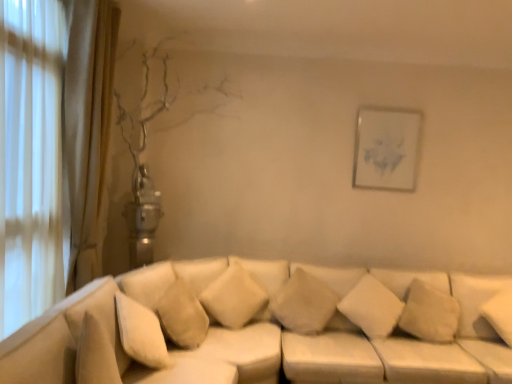
Question: Relative to white soft cushion at center, the fourth pillow positioned from the right, is white paper at upper right in front or behind?

Choices:
 (A) behind
 (B) front

Answer: (A)

Question: Is point (412, 137) positioned closer to the camera than point (229, 309)?

Choices:
 (A) farther
 (B) closer

Answer: (A)

Question: Considering the real-world distances, which object is closest to the white soft cushion at center, which ranks as the first pillow in left-to-right order?

Choices:
 (A) white soft pillow at right, which is the 1th pillow in right-to-left order
 (B) white soft pillow at center, which is counted as the 2th pillow, starting from the left
 (C) white paper at upper right
 (D) white soft pillow at center, which is the 2th pillow in right-to-left order

Answer: (B)

Question: Considering the real-world distances, which object is closest to the white soft pillow at center, positioned as the 3th pillow in left-to-right order?

Choices:
 (A) white soft pillow at center, which is counted as the 3th pillow, starting from the right
 (B) white soft pillow at right, which is the 1th pillow in right-to-left order
 (C) white soft cushion at center, the fourth pillow positioned from the right
 (D) white paper at upper right

Answer: (A)